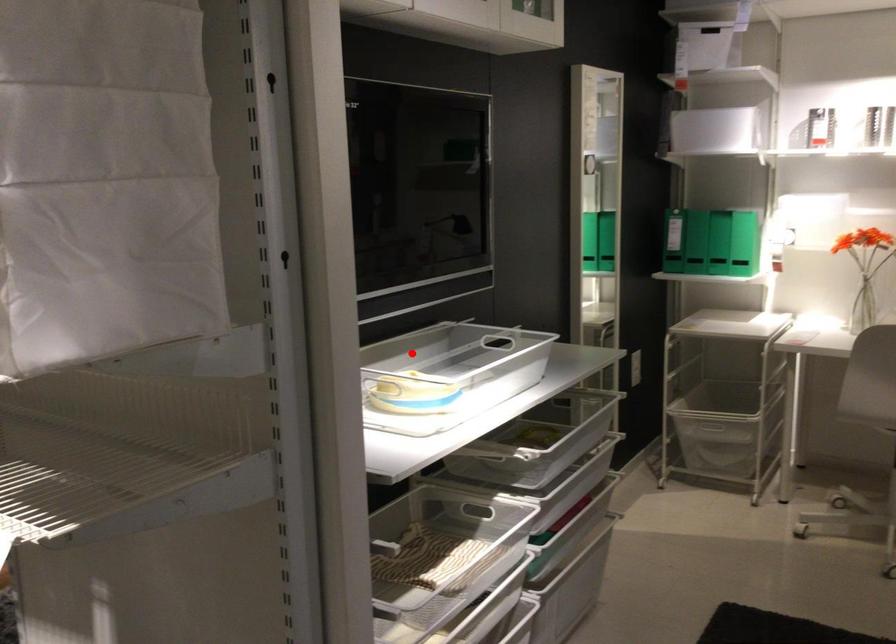
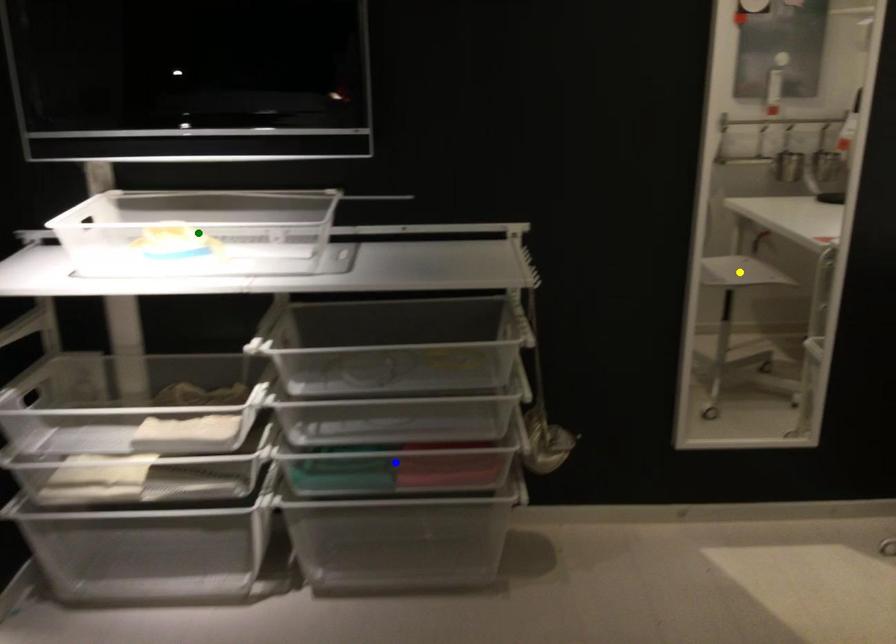
Question: I am providing you with two images of the same scene from different viewpoints. A red point is marked on the first image. You are given multiple points on the second image. In image 2, which mark is for the same physical point as the one in image 1?

Choices:
 (A) yellow point
 (B) green point
 (C) blue point

Answer: (B)